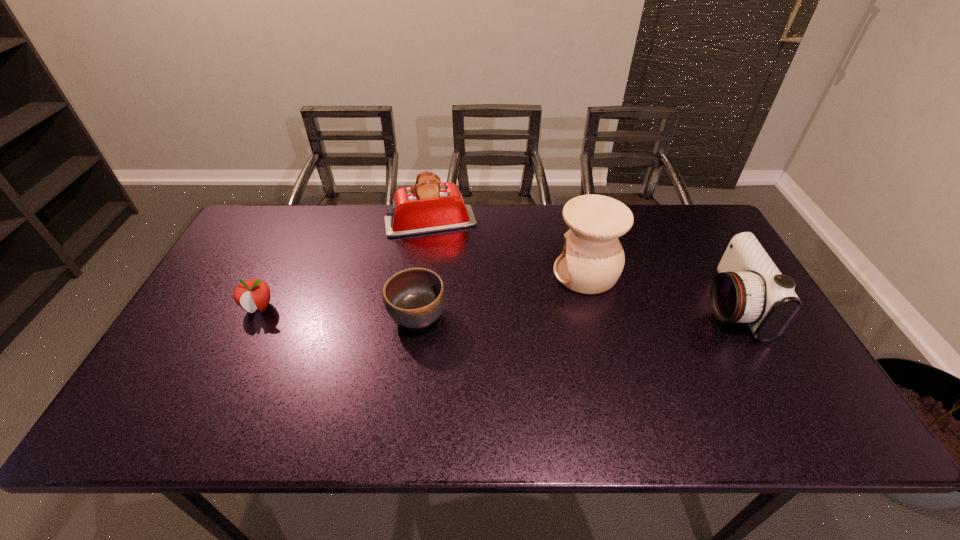
I want to click on the fourth object from left to right, so click(592, 260).

Locate an element on the screen. pottery is located at coordinates (592, 260).

The image size is (960, 540). Find the location of `the farthest object`. the farthest object is located at coordinates (429, 206).

Identify the location of the rightmost object. The width and height of the screenshot is (960, 540). (749, 288).

Where is `bowl`? The height and width of the screenshot is (540, 960). bowl is located at coordinates (414, 298).

I want to click on apple, so click(252, 294).

Where is `vacant space located 0.180m at the open side of the tallest object`? This screenshot has height=540, width=960. vacant space located 0.180m at the open side of the tallest object is located at coordinates (492, 273).

Identify the location of vacant space located 0.390m at the open side of the tallest object. (421, 273).

Identify the location of vacant area located at the open side of the tallest object. (523, 273).

This screenshot has height=540, width=960. What are the coordinates of `vacant area situated on the front of the toaster` in the screenshot? It's located at (419, 307).